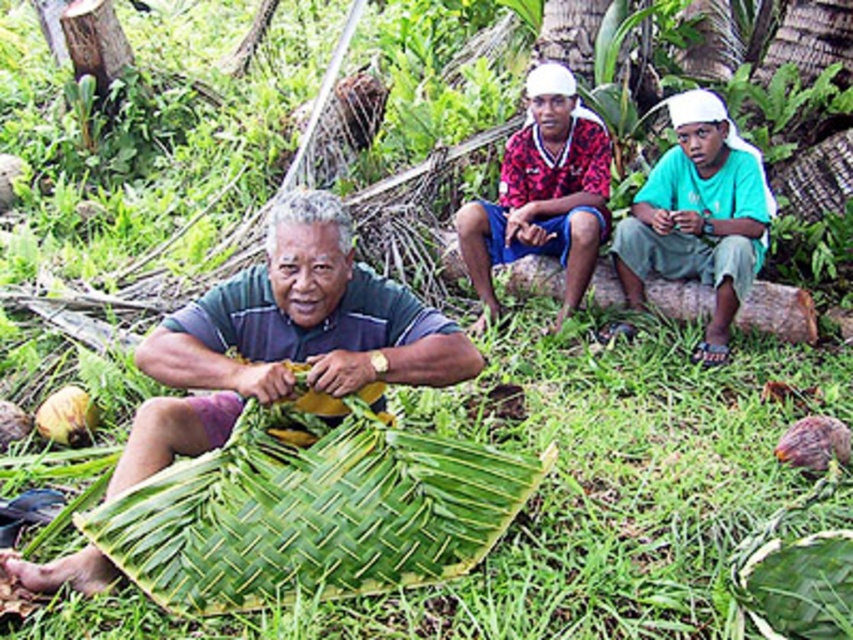
Does point (582, 488) come in front of point (723, 316)?

Yes, point (582, 488) is closer to viewer.

Is green leafy grass at center above green cotton shirt at upper right?

Actually, green leafy grass at center is below green cotton shirt at upper right.

Is point (668, 568) positioned behind point (645, 230)?

No, (668, 568) is in front of (645, 230).

At what (x,y) coordinates should I click in order to perform the action: click on green leafy grass at center. Please return your answer as a coordinate pair (x, y). Image resolution: width=853 pixels, height=640 pixels. Looking at the image, I should click on (577, 497).

Is green cotton shirt at upper right wider than printed fabric shirt at upper right?

No.

Can you confirm if green cotton shirt at upper right is positioned to the left of printed fabric shirt at upper right?

Incorrect, green cotton shirt at upper right is not on the left side of printed fabric shirt at upper right.

I want to click on green cotton shirt at upper right, so (698, 216).

This screenshot has height=640, width=853. In order to click on green cotton shirt at upper right in this screenshot , I will do `click(698, 216)`.

Does green leafy grass at center appear on the right side of green woven leaf at center?

Answer: Yes, green leafy grass at center is to the right of green woven leaf at center.

Which is behind, point (792, 372) or point (221, 564)?

Point (792, 372)

Which is behind, point (561, 497) or point (244, 538)?

The point (561, 497) is behind.

This screenshot has height=640, width=853. I want to click on green leafy grass at center, so click(577, 497).